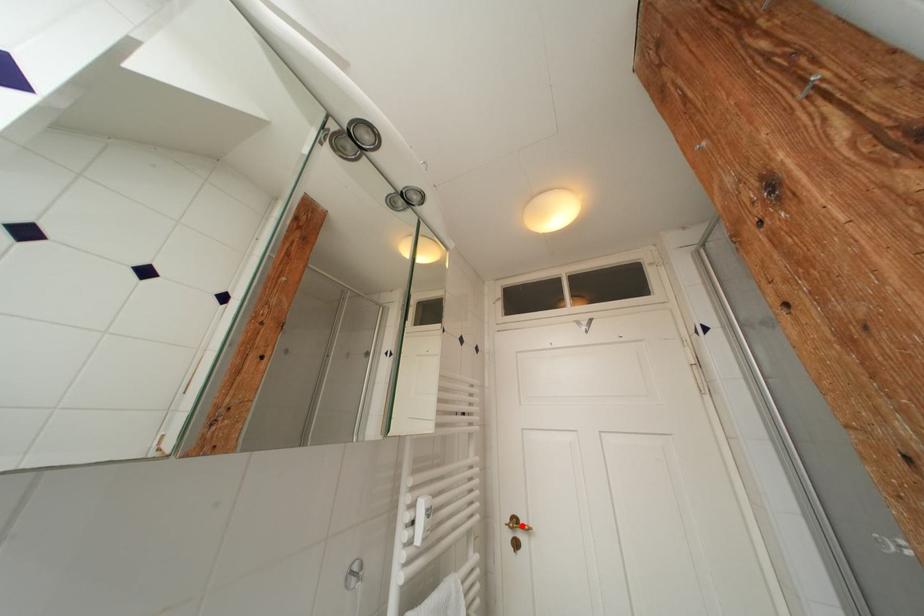
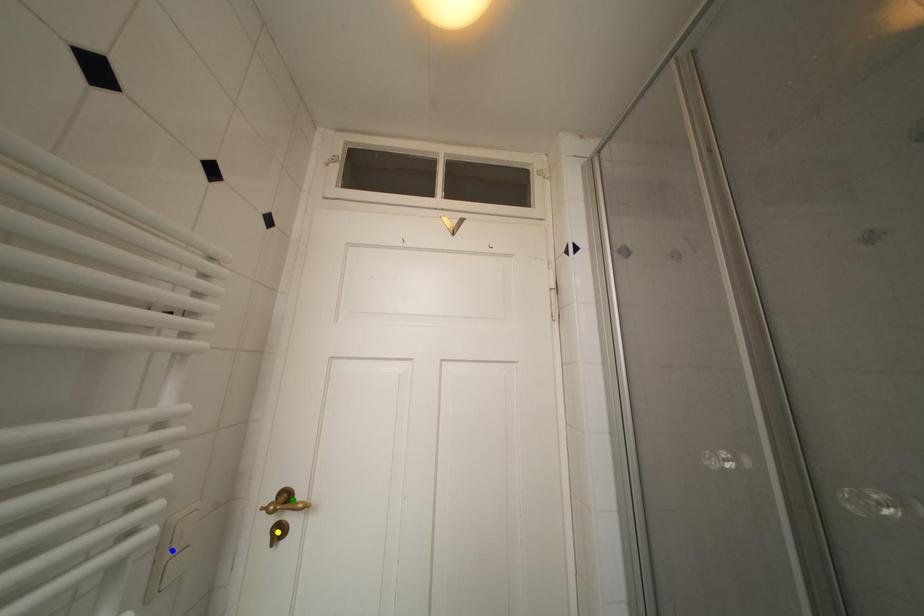
Question: I am providing you with two images of the same scene from different viewpoints. A red point is marked on the first image. You are given multiple points on the second image. Can you choose the point in image 2 that corresponds to the point in image 1?

Choices:
 (A) green point
 (B) yellow point
 (C) blue point

Answer: (A)